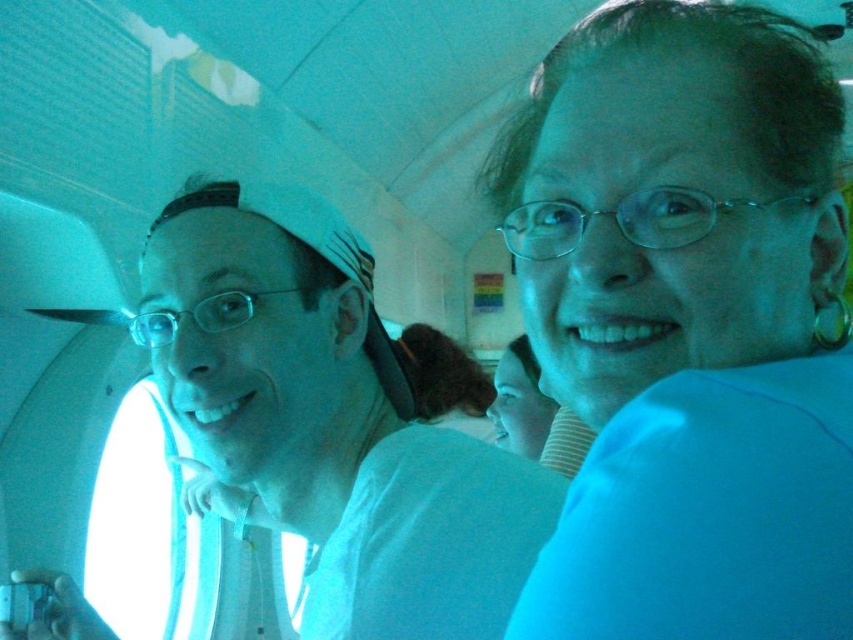
Between blue fabric shirt at upper right and white fabric at left, which one has more height?

With more height is white fabric at left.

Between blue fabric shirt at upper right and white fabric at left, which one appears on the right side from the viewer's perspective?

blue fabric shirt at upper right

Is point (579, 488) positioned after point (245, 268)?

No.

The width and height of the screenshot is (853, 640). I want to click on blue fabric shirt at upper right, so click(688, 324).

In the scene shown: Measure the distance between white fabric at left and smooth skin face at center.

white fabric at left and smooth skin face at center are 1.29 meters apart from each other.

Does white fabric at left appear on the left side of smooth skin face at center?

Indeed, white fabric at left is positioned on the left side of smooth skin face at center.

Between point (334, 252) and point (506, 364), which one is positioned behind?

Positioned behind is point (506, 364).

Image resolution: width=853 pixels, height=640 pixels. Identify the location of white fabric at left. (329, 422).

From the picture: Does blue fabric shirt at upper right have a larger size compared to smooth skin face at center?

Yes.

You are a GUI agent. You are given a task and a screenshot of the screen. Output one action in this format:
    pyautogui.click(x=<x>, y=<y>)
    Task: Click on the blue fabric shirt at upper right
    This screenshot has width=853, height=640.
    Given the screenshot: What is the action you would take?
    pyautogui.click(x=688, y=324)